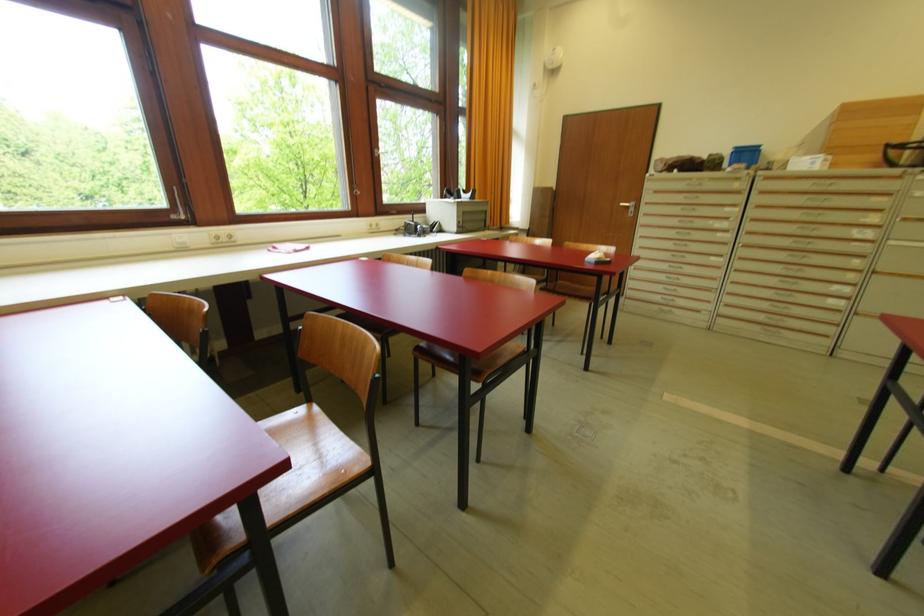
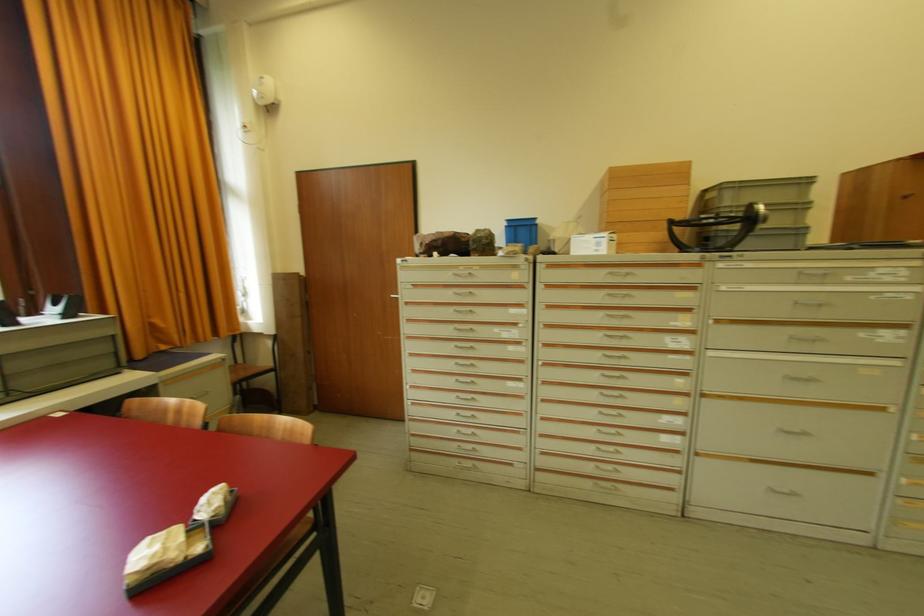
The point at (x=685, y=197) is marked in the first image. Where is the corresponding point in the second image?

(454, 293)